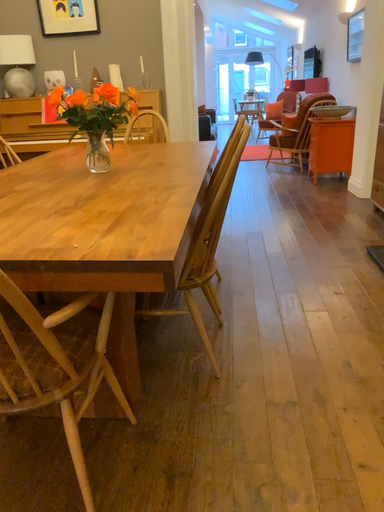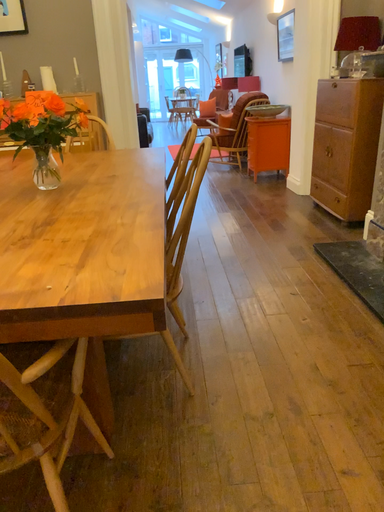
Question: How did the camera likely rotate when shooting the video?

Choices:
 (A) rotated right
 (B) rotated left

Answer: (A)